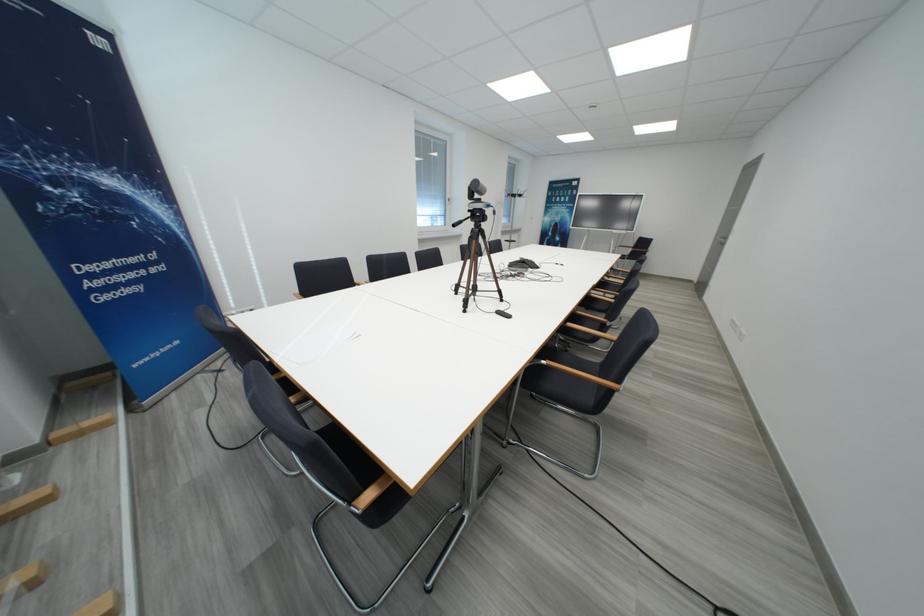
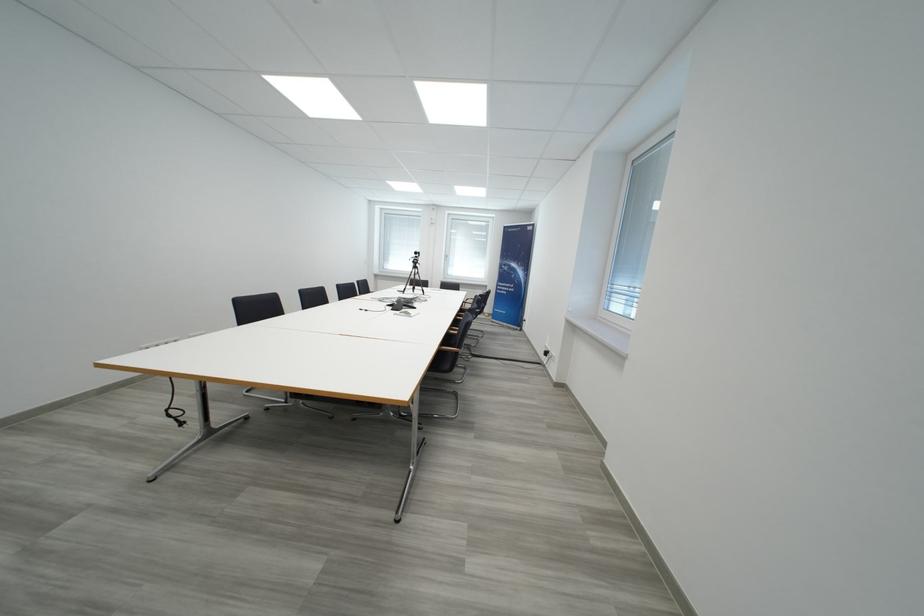
Locate, in the second image, the point that corresponds to [545,270] in the first image.

(395, 309)